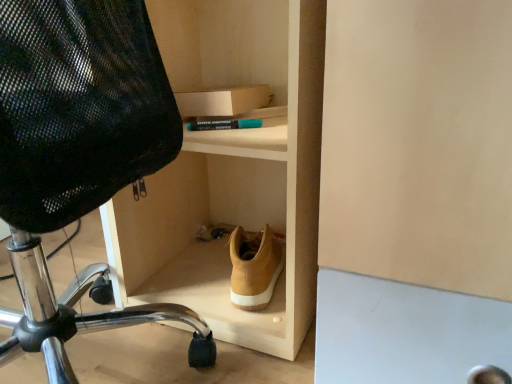
Locate an element on the screen. The width and height of the screenshot is (512, 384). light wood shoe at lower center is located at coordinates (231, 170).

Describe the element at coordinates (254, 267) in the screenshot. The width and height of the screenshot is (512, 384). I see `tan suede shoe at center` at that location.

Where is `light wood shoe at lower center`? This screenshot has width=512, height=384. light wood shoe at lower center is located at coordinates (231, 170).

In the scene shown: From the image's perspective, which is below, light wood shoe at lower center or tan suede shoe at center?

tan suede shoe at center, from the image's perspective.

Does light wood shoe at lower center have a lesser height compared to tan suede shoe at center?

No, light wood shoe at lower center is not shorter than tan suede shoe at center.

From a real-world perspective, which is physically above, light wood shoe at lower center or tan suede shoe at center?

light wood shoe at lower center, from a real-world perspective.

Find the location of a particular element. shoe that appears below the light wood shoe at lower center (from a real-world perspective) is located at coordinates (254, 267).

From the image's perspective, between tan suede shoe at center and light wood shoe at lower center, which one is located above?

light wood shoe at lower center.

Is tan suede shoe at center not close to light wood shoe at lower center?

No.

Considering the relative positions of tan suede shoe at center and light wood shoe at lower center in the image provided, is tan suede shoe at center to the left or to the right of light wood shoe at lower center?

tan suede shoe at center is positioned on light wood shoe at lower center's right side.

Does tan suede shoe at center turn towards black mesh chair at left?

No, tan suede shoe at center is not facing towards black mesh chair at left.

Considering the sizes of objects tan suede shoe at center and black mesh chair at left in the image provided, who is wider, tan suede shoe at center or black mesh chair at left?

Wider between the two is black mesh chair at left.

Considering the relative positions of tan suede shoe at center and black mesh chair at left in the image provided, is tan suede shoe at center behind black mesh chair at left?

Yes, it is behind black mesh chair at left.

Which of these two, tan suede shoe at center or black mesh chair at left, stands shorter?

tan suede shoe at center.

The height and width of the screenshot is (384, 512). I want to click on shelf to the right of black mesh chair at left, so coord(231,170).

From the image's perspective, who appears lower, black mesh chair at left or light wood shoe at lower center?

black mesh chair at left.

Considering the positions of objects black mesh chair at left and light wood shoe at lower center in the image provided, who is more to the left, black mesh chair at left or light wood shoe at lower center?

Positioned to the left is black mesh chair at left.

Image resolution: width=512 pixels, height=384 pixels. Identify the location of shoe below the black mesh chair at left (from a real-world perspective). (254, 267).

Visually, is black mesh chair at left positioned to the left or to the right of tan suede shoe at center?

In the image, black mesh chair at left appears on the left side of tan suede shoe at center.

Between point (38, 11) and point (240, 295), which one is positioned in front?

The point (38, 11) is more forward.

From the image's perspective, between light wood shoe at lower center and black mesh chair at left, who is located below?

black mesh chair at left is shown below in the image.

How many degrees apart are the facing directions of light wood shoe at lower center and black mesh chair at left?

light wood shoe at lower center and black mesh chair at left are facing 86.2 degrees away from each other.

Locate an element on the screen. This screenshot has width=512, height=384. shelf located on the right of black mesh chair at left is located at coordinates 231,170.

Are light wood shoe at lower center and black mesh chair at left far apart?

No, light wood shoe at lower center is not far away from black mesh chair at left.

Locate an element on the screen. The height and width of the screenshot is (384, 512). shelf above the tan suede shoe at center (from a real-world perspective) is located at coordinates (231, 170).

Where is `shoe below the light wood shoe at lower center (from a real-world perspective)`? This screenshot has height=384, width=512. shoe below the light wood shoe at lower center (from a real-world perspective) is located at coordinates click(x=254, y=267).

Considering their positions, is light wood shoe at lower center positioned closer to tan suede shoe at center than black mesh chair at left?

The object closer to tan suede shoe at center is light wood shoe at lower center.

Which object lies further to the anchor point light wood shoe at lower center, black mesh chair at left or tan suede shoe at center?

black mesh chair at left lies further to light wood shoe at lower center than the other object.

Looking at the image, which one is located closer to light wood shoe at lower center, tan suede shoe at center or black mesh chair at left?

The object closer to light wood shoe at lower center is tan suede shoe at center.

From the image, which object appears to be nearer to black mesh chair at left, light wood shoe at lower center or tan suede shoe at center?

tan suede shoe at center.

Based on their spatial positions, is tan suede shoe at center or light wood shoe at lower center further from black mesh chair at left?

light wood shoe at lower center lies further to black mesh chair at left than the other object.

Which object lies further to the anchor point tan suede shoe at center, black mesh chair at left or light wood shoe at lower center?

black mesh chair at left lies further to tan suede shoe at center than the other object.

Locate an element on the screen. Image resolution: width=512 pixels, height=384 pixels. shelf located between black mesh chair at left and tan suede shoe at center in the depth direction is located at coordinates (231, 170).